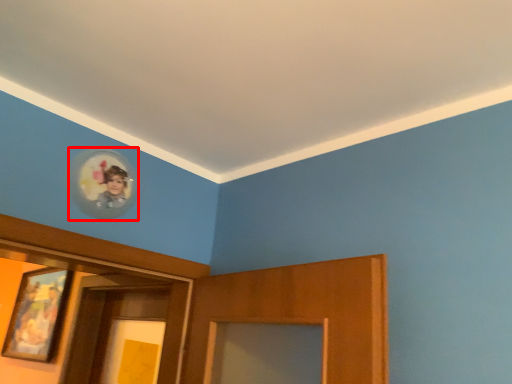
Question: Where is picture frame (annotated by the red box) located in relation to picture frame in the image?

Choices:
 (A) left
 (B) right

Answer: (B)